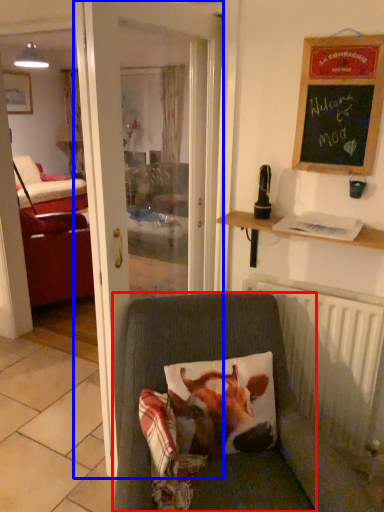
Question: Which of the following is the farthest to the observer, chair (highlighted by a red box) or door (highlighted by a blue box)?

Choices:
 (A) chair
 (B) door

Answer: (B)